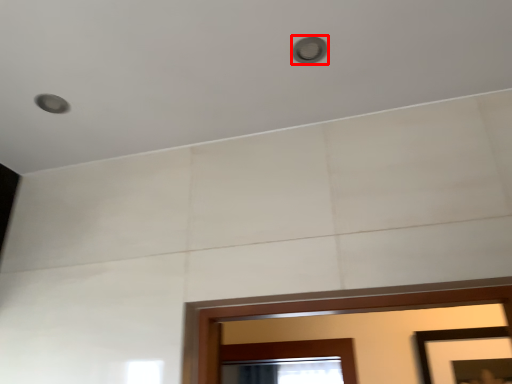
Question: In this image, where is light (annotated by the red box) located relative to picture frame?

Choices:
 (A) right
 (B) left

Answer: (B)